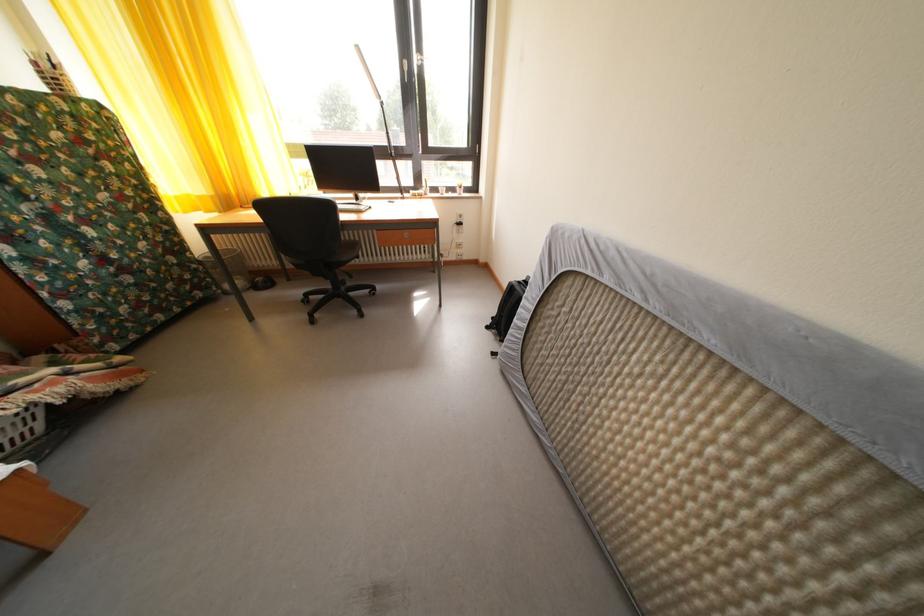
Which object does [20,428] point to?

It refers to a white laundry basket.